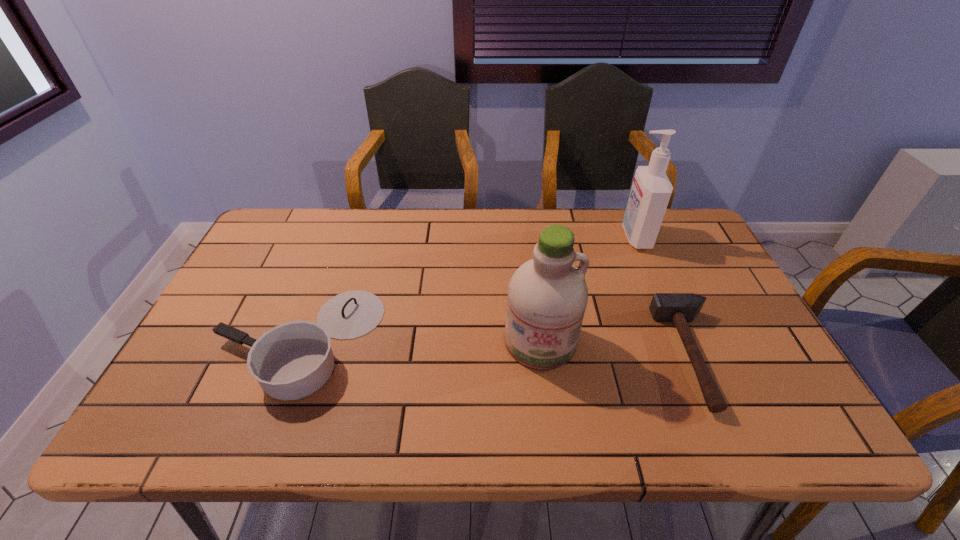
You are a GUI agent. You are given a task and a screenshot of the screen. Output one action in this format:
    pyautogui.click(x=<x>, y=<y>)
    Task: Click on the hammer situated at the right edge
    The height and width of the screenshot is (540, 960).
    Given the screenshot: What is the action you would take?
    pyautogui.click(x=680, y=308)

This screenshot has height=540, width=960. Identify the location of object that is at the near left corner. (293, 360).

The height and width of the screenshot is (540, 960). I want to click on object that is at the far right corner, so click(651, 190).

Locate an element on the screen. Image resolution: width=960 pixels, height=540 pixels. object located at the near right corner is located at coordinates (680, 308).

In the image, there is a desktop. At what (x,y) coordinates should I click in order to perform the action: click on vacant region at the far edge. Please return your answer as a coordinate pair (x, y). Looking at the image, I should click on (628, 242).

In the image, there is a desktop. At what (x,y) coordinates should I click in order to perform the action: click on vacant space at the near edge. Please return your answer as a coordinate pair (x, y). Image resolution: width=960 pixels, height=540 pixels. Looking at the image, I should click on (488, 414).

This screenshot has width=960, height=540. In order to click on vacant space at the left edge of the desktop in this screenshot , I will do `click(277, 275)`.

Find the location of a particular element. The image size is (960, 540). vacant area at the right edge is located at coordinates (706, 304).

You are a GUI agent. You are given a task and a screenshot of the screen. Output one action in this format:
    pyautogui.click(x=<x>, y=<y>)
    Task: Click on the free space at the far left corner of the desktop
    
    Given the screenshot: What is the action you would take?
    pyautogui.click(x=297, y=223)

In the image, there is a desktop. Identify the location of vacant space at the near left corner. Image resolution: width=960 pixels, height=540 pixels. (206, 413).